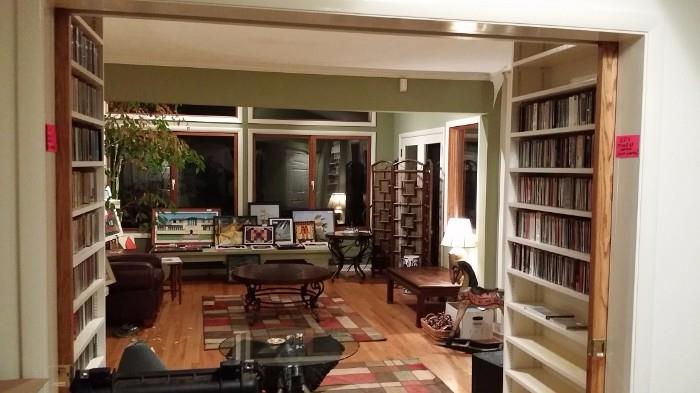
Find the location of a particular element. This screenshot has height=393, width=700. wooden floor is located at coordinates (386, 313).